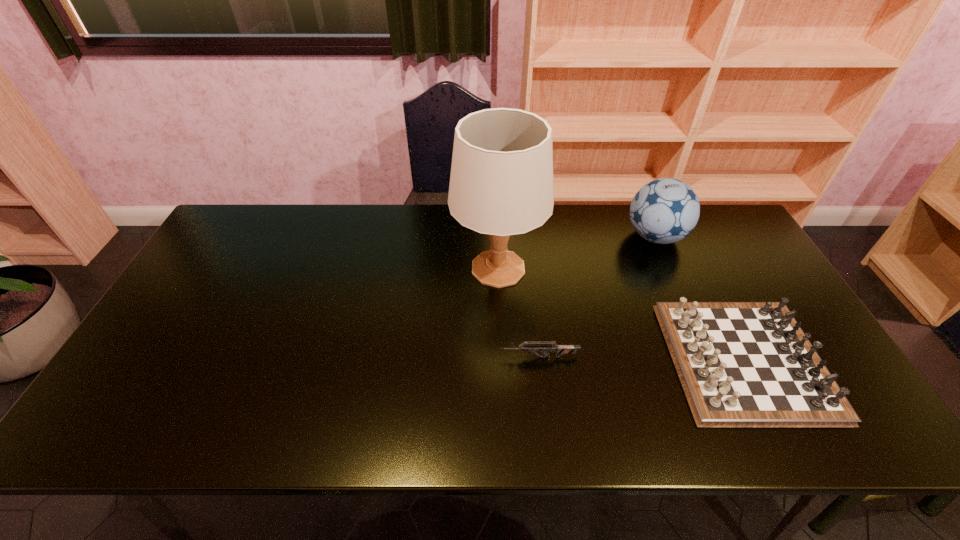
Identify the location of free space that is in between the gun and the table lamp. The image size is (960, 540). (518, 313).

In order to click on free space between the table lamp and the chessboard in this screenshot , I will do `click(621, 314)`.

Find the location of `blank region between the chessboard and the tallest object`. blank region between the chessboard and the tallest object is located at coordinates (621, 314).

Where is `unoccupied position between the third shortest object and the table lamp`? This screenshot has height=540, width=960. unoccupied position between the third shortest object and the table lamp is located at coordinates (577, 253).

Identify the location of object that is the third closest to the table lamp. The image size is (960, 540). (741, 364).

Where is `object that stands as the closest to the soccer ball`? object that stands as the closest to the soccer ball is located at coordinates (741, 364).